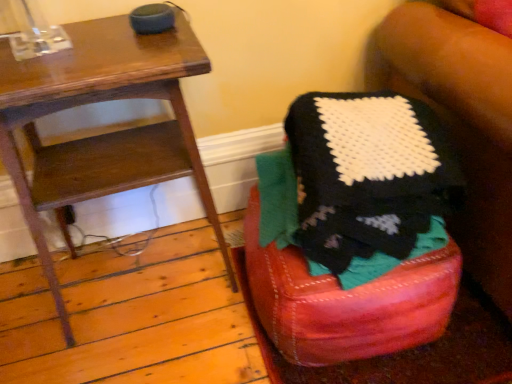
Where is `vacant space in between wooden side table at left and knitted fabric stool at lower right`? This screenshot has height=384, width=512. vacant space in between wooden side table at left and knitted fabric stool at lower right is located at coordinates (193, 336).